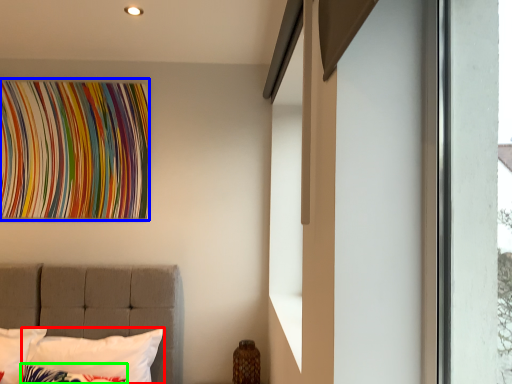
Question: Based on their relative distances, which object is farther from pillow (highlighted by a red box)? Choose from tapestry (highlighted by a blue box) and pillow (highlighted by a green box).

Choices:
 (A) tapestry
 (B) pillow

Answer: (A)